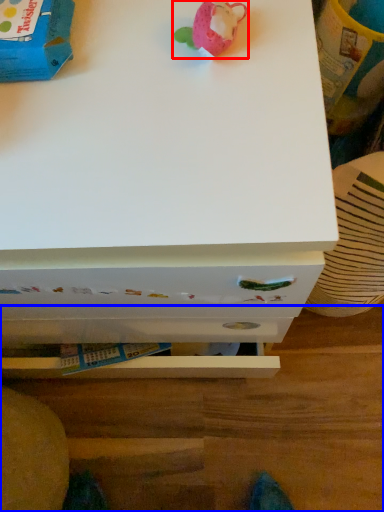
Question: Which of the following is the farthest to the observer, toy (highlighted by a red box) or table (highlighted by a blue box)?

Choices:
 (A) toy
 (B) table

Answer: (B)